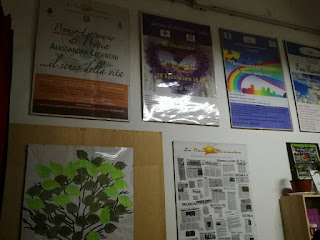
What are the coordinates of `shelf` in the screenshot? It's located at (298, 215).